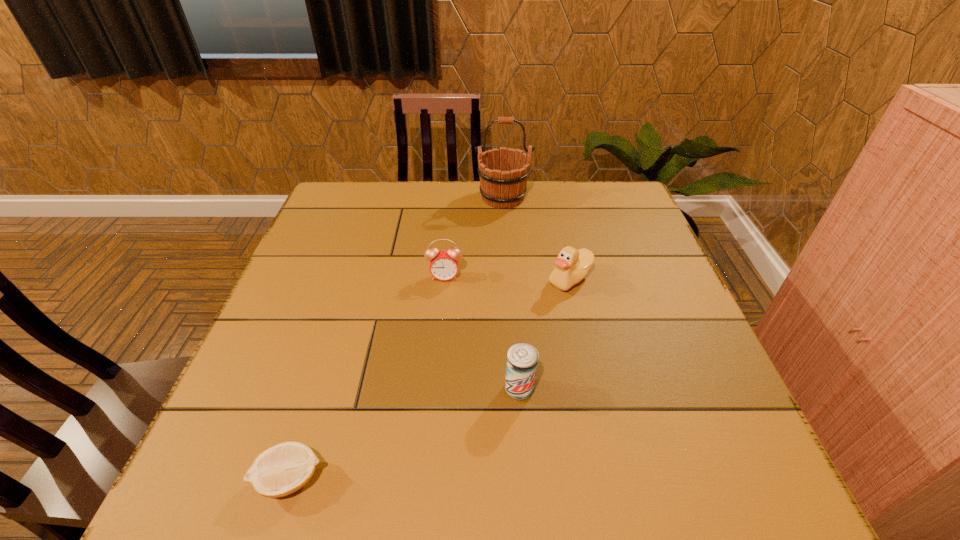
The height and width of the screenshot is (540, 960). Find the location of `the tallest object`. the tallest object is located at coordinates (503, 173).

This screenshot has height=540, width=960. I want to click on wine bucket, so click(503, 173).

This screenshot has height=540, width=960. In order to click on alarm clock in this screenshot , I will do `click(443, 266)`.

Locate an element on the screen. This screenshot has height=540, width=960. the fourth farthest object is located at coordinates (522, 359).

In order to click on duck in this screenshot , I will do `click(572, 265)`.

Locate an element on the screen. This screenshot has height=540, width=960. the shortest object is located at coordinates (281, 470).

Identify the location of the leftmost object. coord(281,470).

The height and width of the screenshot is (540, 960). What are the coordinates of `blank area located on the left of the wine bucket` in the screenshot? It's located at (437, 198).

You are a GUI agent. You are given a task and a screenshot of the screen. Output one action in this format:
    pyautogui.click(x=<x>, y=<y>)
    Task: Click on the vacant space located on the clock face of the alarm clock
    The image size is (960, 540).
    Given the screenshot: What is the action you would take?
    pyautogui.click(x=433, y=407)

Where is `vacant area located 0.230m on the back of the second nearest object`? vacant area located 0.230m on the back of the second nearest object is located at coordinates (513, 296).